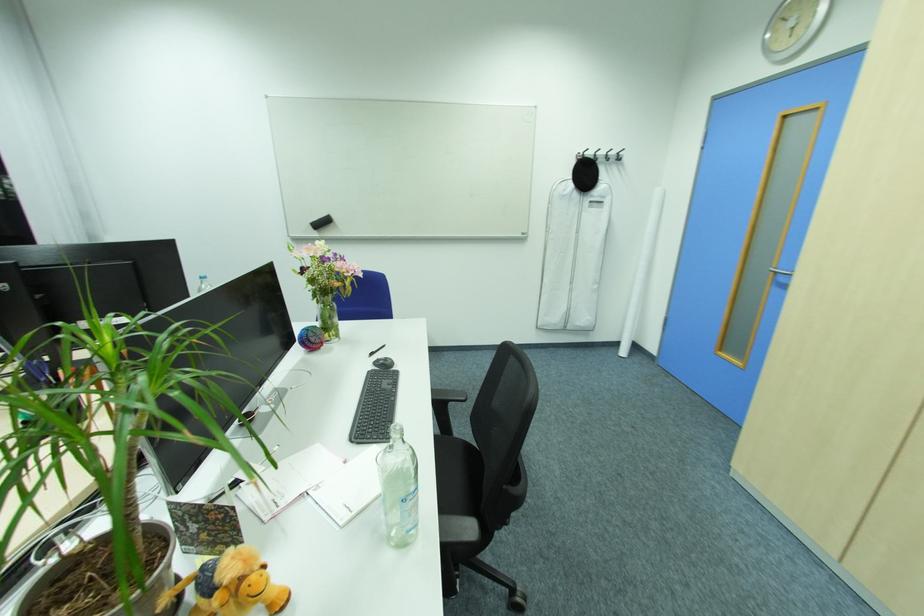
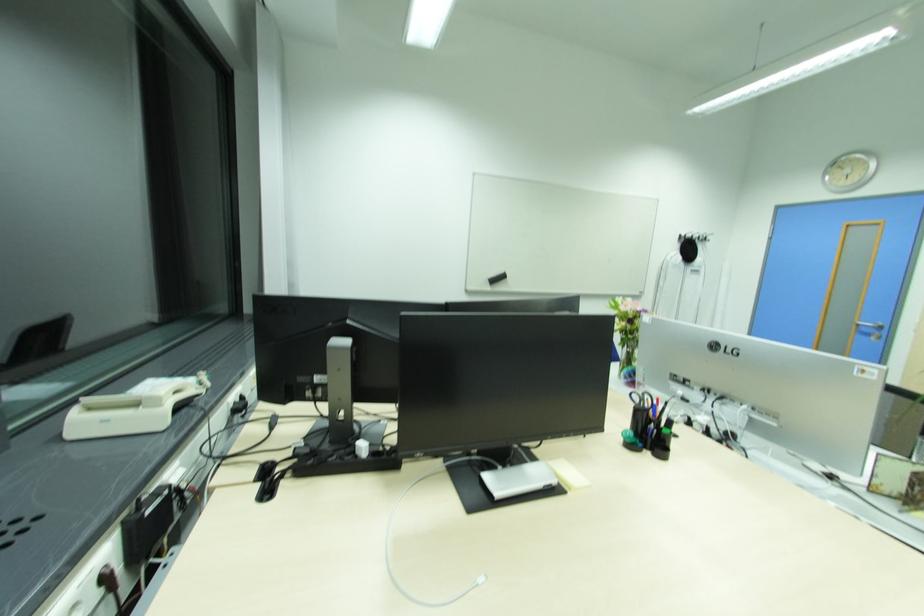
Question: The images are taken continuously from a first-person perspective. In which direction are you moving?

Choices:
 (A) Left
 (B) Right
 (C) Forward
 (D) Backward

Answer: (A)